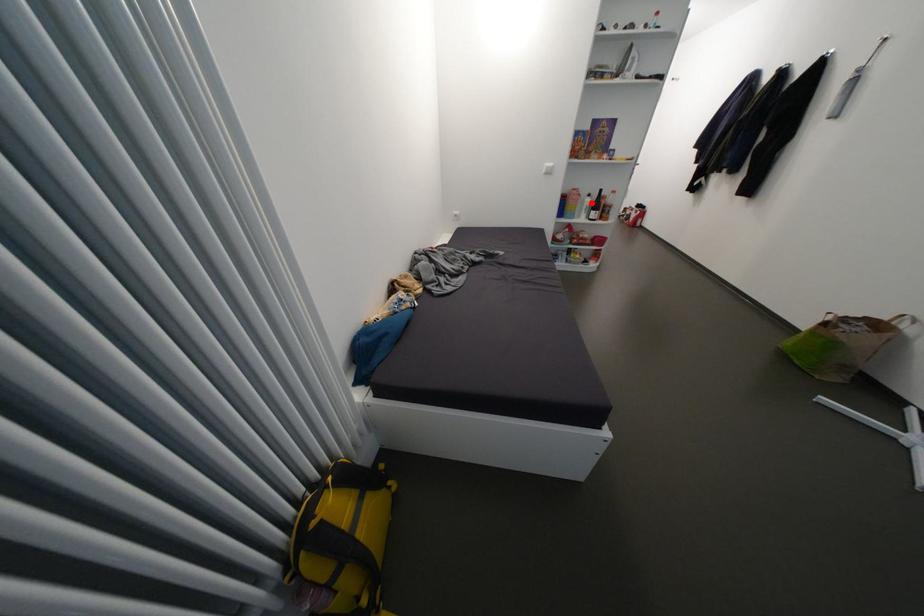
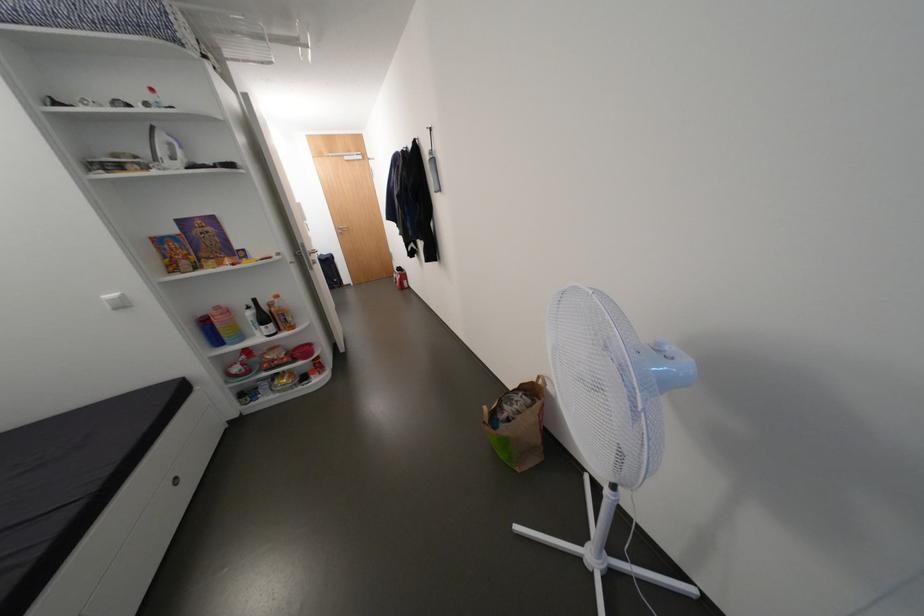
Question: I am providing you with two images of the same scene from different viewpoints. Given a red point in image1, look at the same physical point in image2. Is it:

Choices:
 (A) Closer to the viewpoint
 (B) Farther from the viewpoint

Answer: (B)